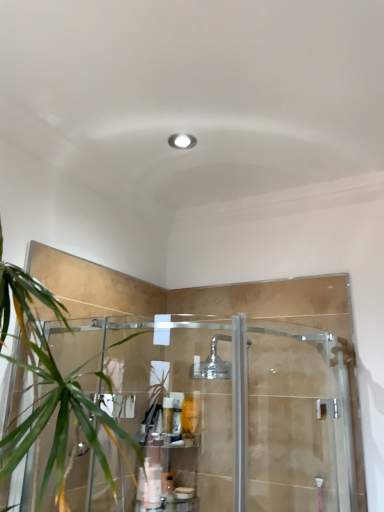
Question: Relative to polished chrome shower head at center, is translucent plastic bottle at center, the 3th toiletry in the bottom-to-top sequence, in front or behind?

Choices:
 (A) behind
 (B) front

Answer: (A)

Question: Looking at the image, does translucent plastic bottle at center, the 3th toiletry in the bottom-to-top sequence, seem bigger or smaller compared to polished chrome shower head at center?

Choices:
 (A) small
 (B) big

Answer: (A)

Question: Based on their relative distances, which object is farther from the white matte bottle at lower center, which is the 2th toiletry in top-to-bottom order?

Choices:
 (A) clear plastic shelf at lower center
 (B) polished chrome shower head at center
 (C) translucent plastic bottle at lower center, which ranks as the 3th toiletry in top-to-bottom order
 (D) translucent plastic bottle at center, arranged as the 1th toiletry when viewed from the top

Answer: (B)

Question: Estimate the real-world distances between objects in this image. Which object is closer to the clear plastic shelf at lower center?

Choices:
 (A) translucent plastic bottle at lower center, positioned as the 1th toiletry in bottom-to-top order
 (B) polished chrome shower head at center
 (C) translucent plastic bottle at center, arranged as the 1th toiletry when viewed from the top
 (D) white matte bottle at lower center, the second toiletry ordered from the bottom

Answer: (C)